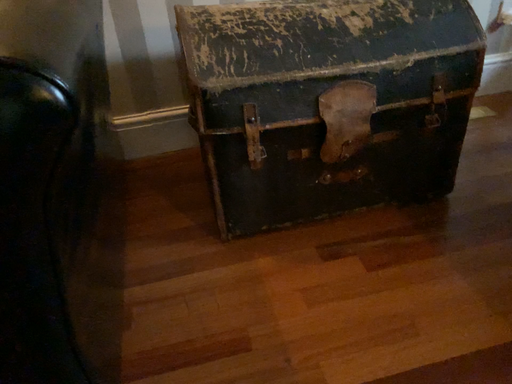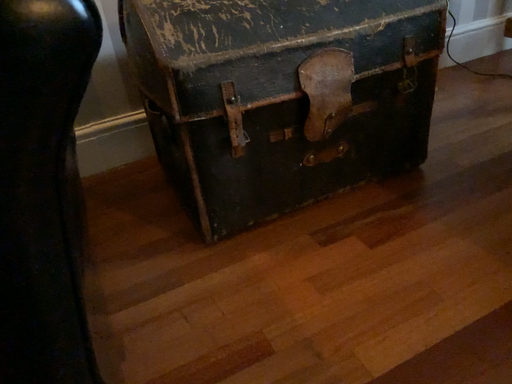
Question: How did the camera likely rotate when shooting the video?

Choices:
 (A) rotated left
 (B) rotated right

Answer: (B)